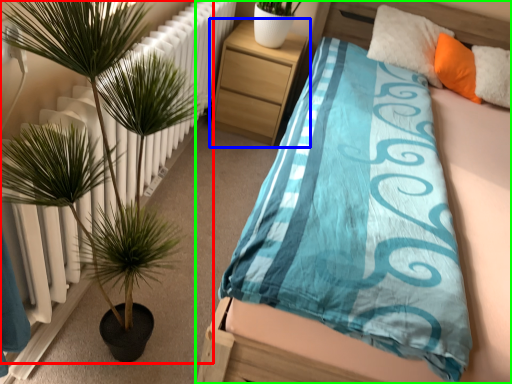
Question: Which object is positioned farthest from houseplant (highlighted by a red box)? Select from nightstand (highlighted by a blue box) and bed (highlighted by a green box).

Choices:
 (A) nightstand
 (B) bed

Answer: (A)